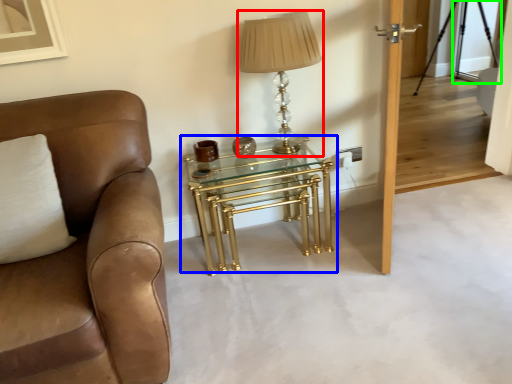
Question: Estimate the real-world distances between objects in this image. Which object is farther from table lamp (highlighted by a red box), table (highlighted by a blue box) or glass door (highlighted by a green box)?

Choices:
 (A) table
 (B) glass door

Answer: (B)